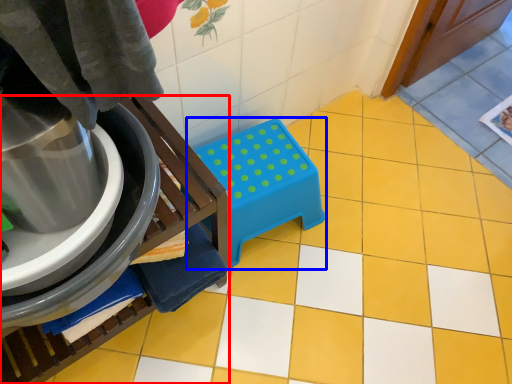
Question: Which object appears closest to the camera in this image, furniture (highlighted by a red box) or step stool (highlighted by a blue box)?

Choices:
 (A) furniture
 (B) step stool

Answer: (A)